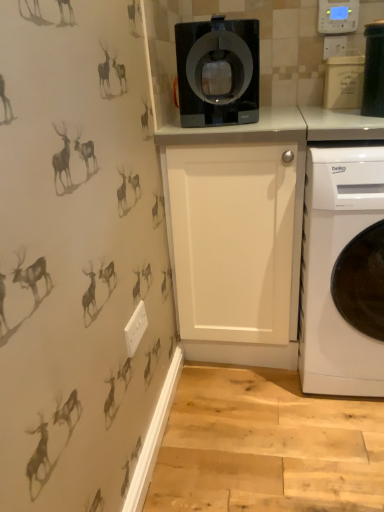
Question: Is the position of white matte container at upper right, which is counted as the second appliance, starting from the front, less distant than that of white glossy washing machine at lower right?

Choices:
 (A) yes
 (B) no

Answer: (B)

Question: Is white matte container at upper right, arranged as the first appliance when viewed from the back, turned away from white glossy washing machine at lower right?

Choices:
 (A) yes
 (B) no

Answer: (B)

Question: Considering the relative sizes of white matte container at upper right, which is counted as the second appliance, starting from the front, and white glossy washing machine at lower right in the image provided, is white matte container at upper right, which is counted as the second appliance, starting from the front, wider than white glossy washing machine at lower right?

Choices:
 (A) no
 (B) yes

Answer: (A)

Question: Is white matte container at upper right, arranged as the first appliance when viewed from the back, aimed at white glossy washing machine at lower right?

Choices:
 (A) yes
 (B) no

Answer: (B)

Question: Considering the relative sizes of white matte container at upper right, which is counted as the second appliance, starting from the front, and white glossy washing machine at lower right in the image provided, is white matte container at upper right, which is counted as the second appliance, starting from the front, taller than white glossy washing machine at lower right?

Choices:
 (A) no
 (B) yes

Answer: (A)

Question: From a real-world perspective, is white glossy washing machine at lower right positioned above or below black plastic container at upper right, marked as the 1th appliance in a front-to-back arrangement?

Choices:
 (A) above
 (B) below

Answer: (B)

Question: Considering the positions of white glossy washing machine at lower right and black plastic container at upper right, marked as the 1th appliance in a front-to-back arrangement, in the image, is white glossy washing machine at lower right bigger or smaller than black plastic container at upper right, marked as the 1th appliance in a front-to-back arrangement,?

Choices:
 (A) small
 (B) big

Answer: (B)

Question: From the image's perspective, is white glossy washing machine at lower right located above or below black plastic container at upper right, placed as the 2th appliance when sorted from back to front?

Choices:
 (A) below
 (B) above

Answer: (A)

Question: Which is correct: white glossy washing machine at lower right is inside black plastic container at upper right, marked as the 1th appliance in a front-to-back arrangement, or outside of it?

Choices:
 (A) inside
 (B) outside

Answer: (B)

Question: Visually, is white matte container at upper right, which is counted as the second appliance, starting from the front, positioned to the left or to the right of white glossy washing machine at lower right?

Choices:
 (A) right
 (B) left

Answer: (B)

Question: Considering the positions of white matte container at upper right, arranged as the first appliance when viewed from the back, and white glossy washing machine at lower right in the image, is white matte container at upper right, arranged as the first appliance when viewed from the back, taller or shorter than white glossy washing machine at lower right?

Choices:
 (A) tall
 (B) short

Answer: (B)

Question: From the image's perspective, is white matte container at upper right, arranged as the first appliance when viewed from the back, positioned above or below white glossy washing machine at lower right?

Choices:
 (A) below
 (B) above

Answer: (B)

Question: Is white matte container at upper right, which is counted as the second appliance, starting from the front, inside or outside of white glossy washing machine at lower right?

Choices:
 (A) outside
 (B) inside

Answer: (A)

Question: From a real-world perspective, is black plastic container at upper right, marked as the 1th appliance in a front-to-back arrangement, positioned above or below black glossy coffee machine at upper center?

Choices:
 (A) below
 (B) above

Answer: (A)

Question: Is black plastic container at upper right, placed as the 2th appliance when sorted from back to front, situated inside black glossy coffee machine at upper center or outside?

Choices:
 (A) outside
 (B) inside

Answer: (A)